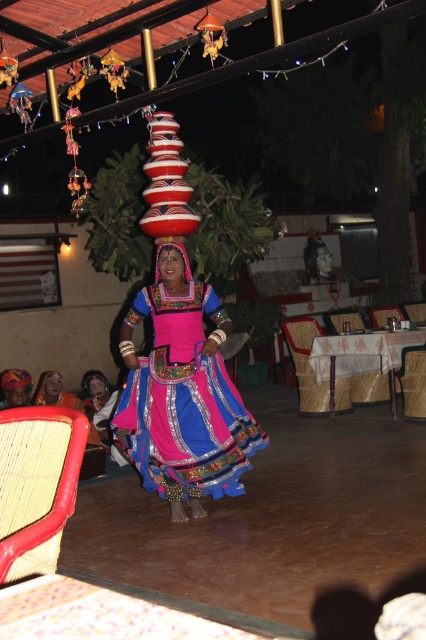
Question: Does matte black head at center have a larger size compared to smooth skin face at center?

Choices:
 (A) yes
 (B) no

Answer: (A)

Question: Is matte pink fabric head at center closer to camera compared to smooth skin face at center?

Choices:
 (A) no
 (B) yes

Answer: (B)

Question: Which point appears closest to the camera in this image?

Choices:
 (A) (28, 515)
 (B) (97, 394)

Answer: (A)

Question: Which object is farther from the camera taking this photo?

Choices:
 (A) matte pink fabric head at center
 (B) shiny blue fabric at center
 (C) matte pink fabric headress at center

Answer: (A)

Question: Does matte black head at center appear over matte pink fabric headress at center?

Choices:
 (A) yes
 (B) no

Answer: (B)

Question: Which object is the farthest from the smooth skin face at center?

Choices:
 (A) matte pink fabric head at center
 (B) matte black head at center

Answer: (B)